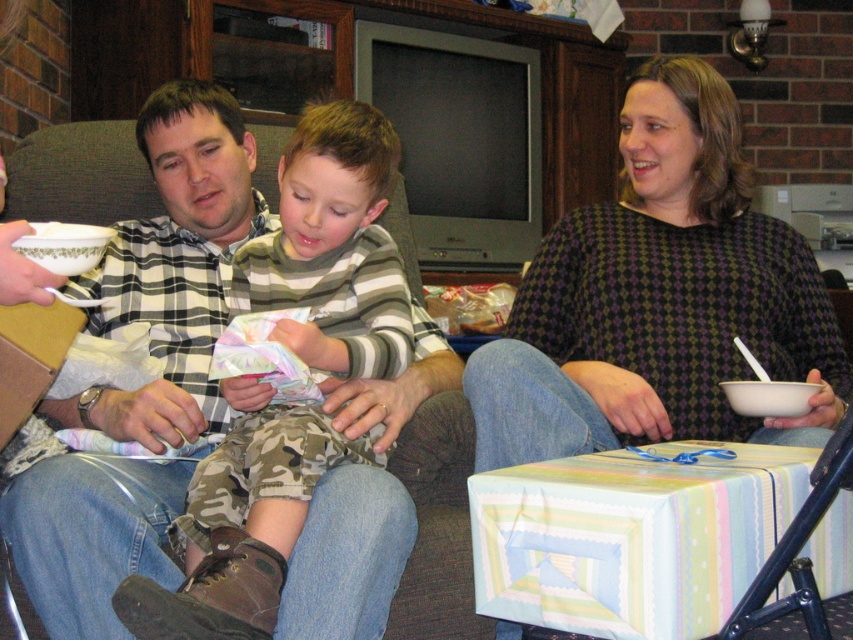
Question: Which point appears farthest from the camera in this image?

Choices:
 (A) (637, 419)
 (B) (318, 337)

Answer: (A)

Question: Is dark green diamond-patterned sweater at center further to the viewer compared to striped cotton shirt at center?

Choices:
 (A) no
 (B) yes

Answer: (B)

Question: Is dark green diamond-patterned sweater at center to the left of striped cotton shirt at center from the viewer's perspective?

Choices:
 (A) no
 (B) yes

Answer: (A)

Question: Which object appears farthest from the camera in this image?

Choices:
 (A) dark green diamond-patterned sweater at center
 (B) striped cotton shirt at center

Answer: (A)

Question: Does dark green diamond-patterned sweater at center appear on the right side of striped cotton shirt at center?

Choices:
 (A) yes
 (B) no

Answer: (A)